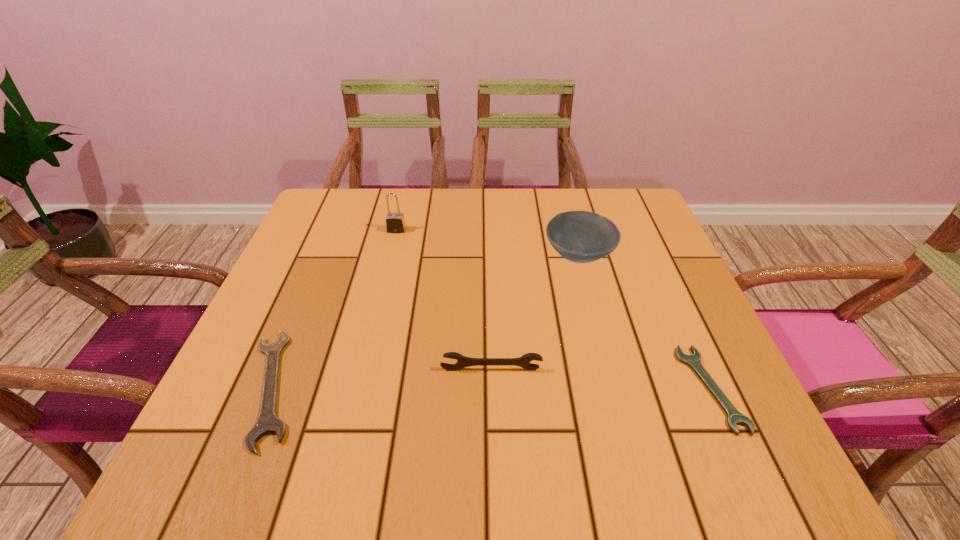
Where is `the farthest object`? the farthest object is located at coordinates (395, 222).

The image size is (960, 540). I want to click on the second object from left to right, so (x=395, y=222).

Where is `the fourth object from left to right`? Image resolution: width=960 pixels, height=540 pixels. the fourth object from left to right is located at coordinates (578, 236).

Locate an element on the screen. bowl is located at coordinates (578, 236).

You are a GUI agent. You are given a task and a screenshot of the screen. Output one action in this format:
    pyautogui.click(x=<x>, y=<y>)
    Task: Click on the tallest wrench
    The image size is (960, 540).
    Given the screenshot: What is the action you would take?
    pyautogui.click(x=524, y=361)

Find the location of a particular element. This screenshot has height=540, width=960. the second wrench from right to left is located at coordinates (524, 361).

The width and height of the screenshot is (960, 540). What are the coordinates of `the fourth tallest object` in the screenshot? It's located at (267, 422).

Locate an element on the screen. This screenshot has width=960, height=540. the second tallest wrench is located at coordinates (267, 422).

Locate an element on the screen. The height and width of the screenshot is (540, 960). the rightmost wrench is located at coordinates (734, 417).

This screenshot has height=540, width=960. In order to click on the shortest object in this screenshot , I will do `click(734, 417)`.